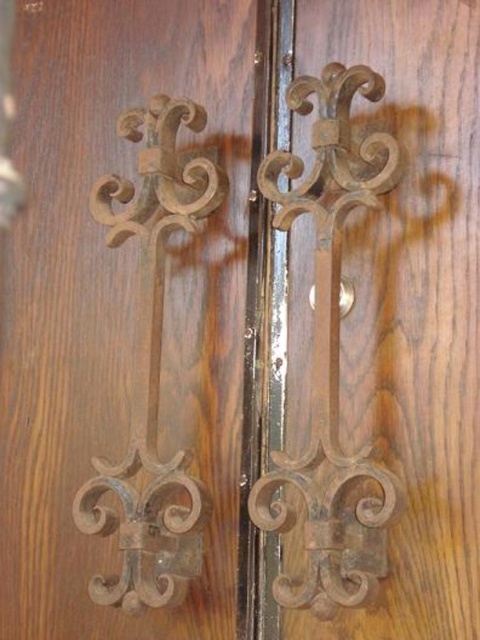
Question: Can you confirm if rusty metal door handle at center is smaller than brown wrought iron at left?

Choices:
 (A) yes
 (B) no

Answer: (B)

Question: Considering the relative positions of rusty metal door handle at center and brown wrought iron at left in the image provided, where is rusty metal door handle at center located with respect to brown wrought iron at left?

Choices:
 (A) below
 (B) above

Answer: (B)

Question: Which point is closer to the camera taking this photo?

Choices:
 (A) (101, 209)
 (B) (355, 182)

Answer: (B)

Question: Among these points, which one is nearest to the camera?

Choices:
 (A) (107, 588)
 (B) (321, 374)

Answer: (B)

Question: Considering the relative positions of rusty metal door handle at center and brown wrought iron at left in the image provided, where is rusty metal door handle at center located with respect to brown wrought iron at left?

Choices:
 (A) left
 (B) right

Answer: (B)

Question: Among these points, which one is farthest from the camera?

Choices:
 (A) (322, 177)
 (B) (156, 444)

Answer: (B)